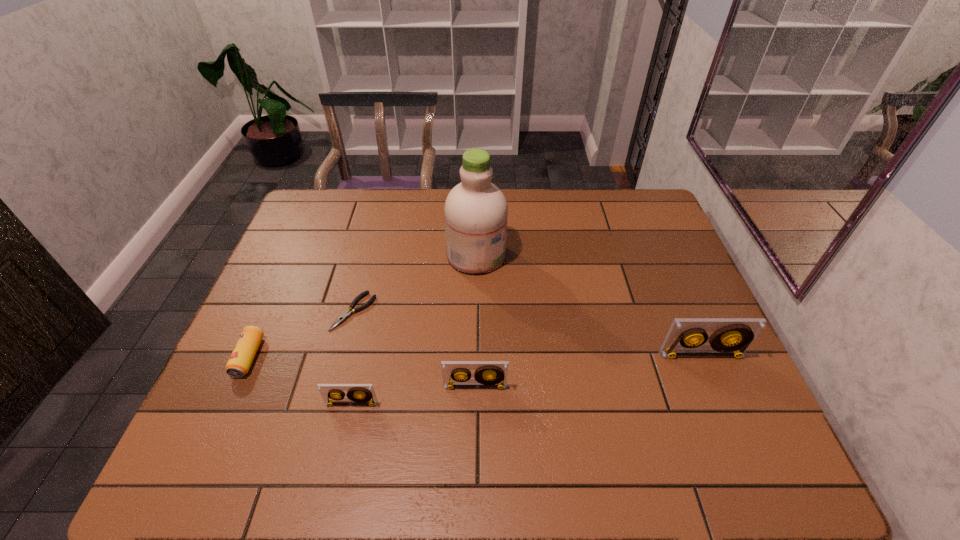
At what (x,y) coordinates should I click in order to perform the action: click on beer can. Please return your answer as a coordinate pair (x, y). This screenshot has width=960, height=540. Looking at the image, I should click on (244, 352).

I want to click on the leftmost object, so click(244, 352).

I want to click on free space located 0.060m at the front of the second nearest object with visible reels, so click(x=475, y=414).

I want to click on vacant space located 0.150m at the front of the second tallest object with visible reels, so click(727, 415).

Locate an element on the screen. vacant space located 0.070m on the front label of the cleansing agent is located at coordinates (528, 255).

The height and width of the screenshot is (540, 960). What are the coordinates of `free space located on the back of the fifth nearest object` in the screenshot? It's located at (380, 212).

The height and width of the screenshot is (540, 960). I want to click on vacant position located on the right of the second shortest object, so click(406, 357).

Find the location of a particular element. object that is positioned at the near edge is located at coordinates (361, 394).

Where is `object positioned at the left edge`? object positioned at the left edge is located at coordinates (244, 352).

Find the location of `object at the right edge`. object at the right edge is located at coordinates (732, 337).